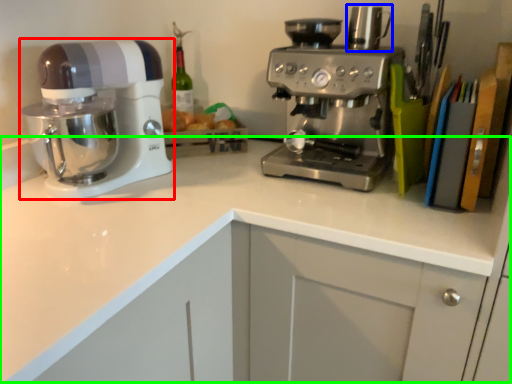
Question: Which is nearer to the mixer (highlighted by a red box)? appliance (highlighted by a blue box) or counter top (highlighted by a green box).

Choices:
 (A) appliance
 (B) counter top

Answer: (B)